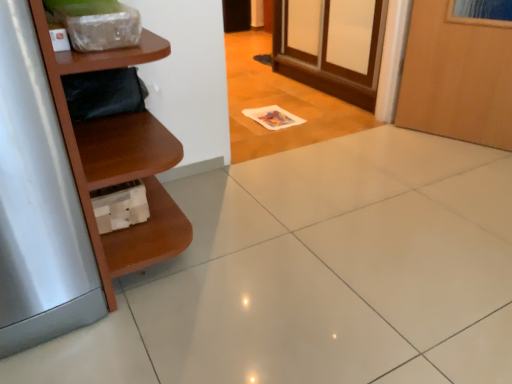
You are a GUI agent. You are given a task and a screenshot of the screen. Output one action in this format:
    pyautogui.click(x=<x>, y=<y>)
    Task: Click on the free space in front of brown wood shelf at left
    This screenshot has height=384, width=512.
    Given the screenshot: What is the action you would take?
    pyautogui.click(x=174, y=342)